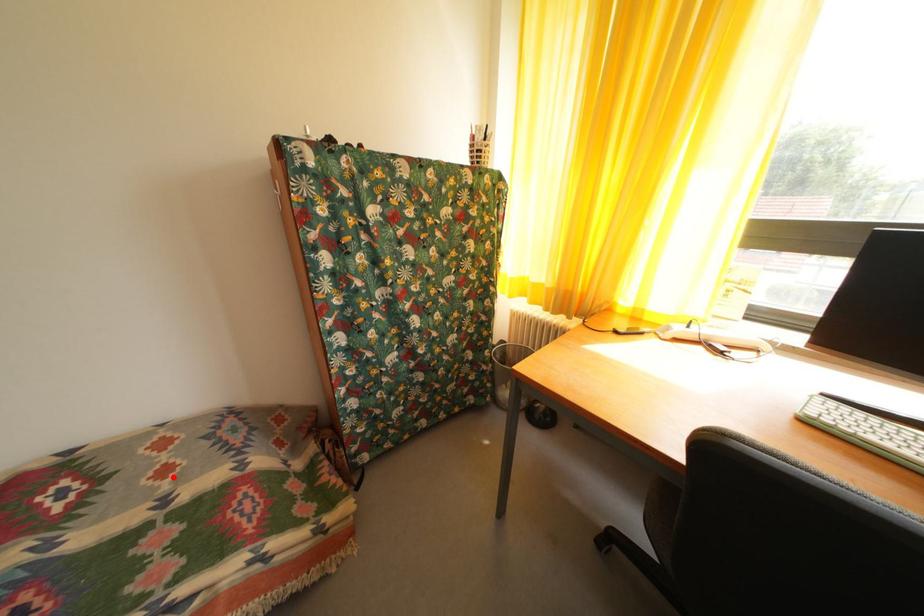
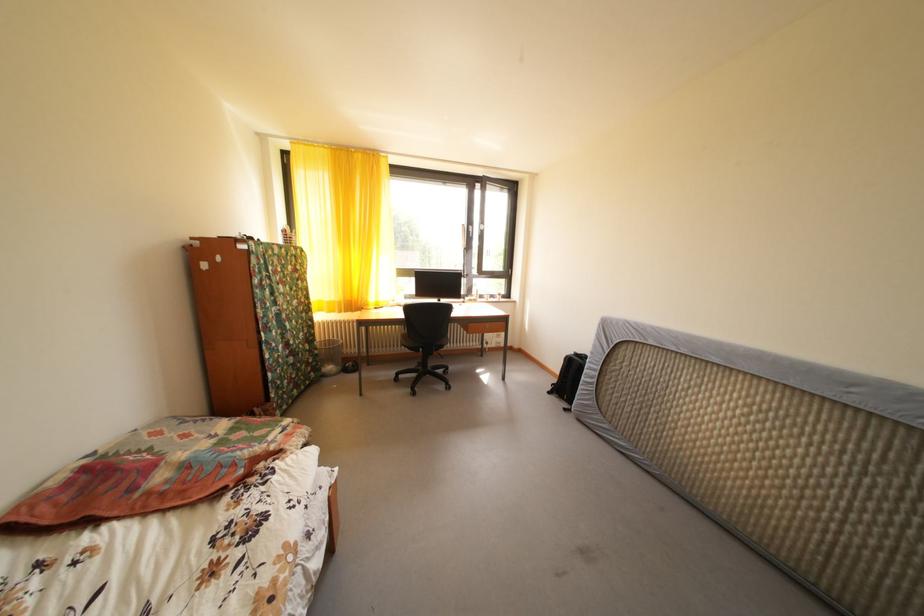
In the second image, find the point that corresponds to the highlighted location in the first image.

(195, 442)